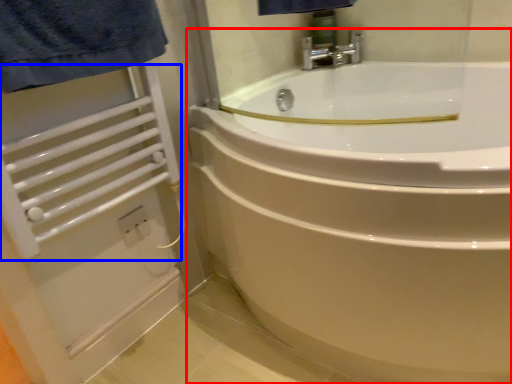
Question: Which object appears farthest to the camera in this image, bathtub (highlighted by a red box) or balustrade (highlighted by a blue box)?

Choices:
 (A) bathtub
 (B) balustrade

Answer: (B)